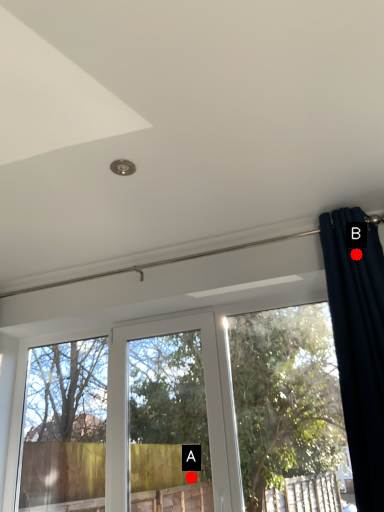
Question: Two points are circled on the image, labeled by A and B beside each circle. Which point is farther to the camera?

Choices:
 (A) A is further
 (B) B is further

Answer: (A)